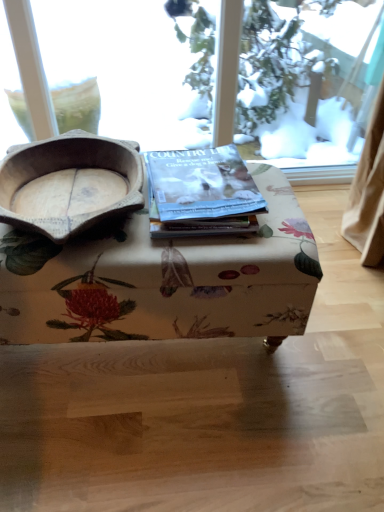
Where is `vacant area that lies to the right of floral fabric ottoman at center`? This screenshot has height=512, width=384. vacant area that lies to the right of floral fabric ottoman at center is located at coordinates (327, 338).